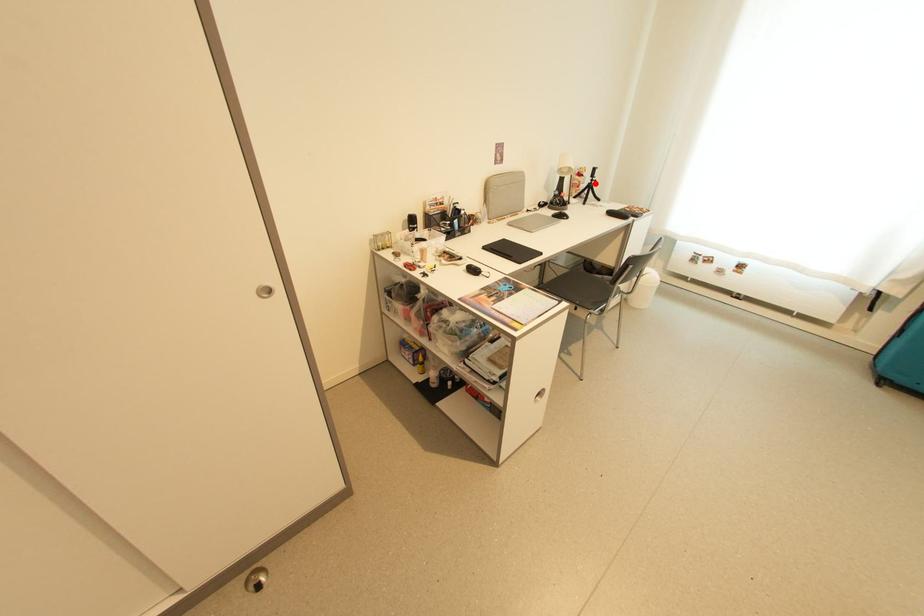
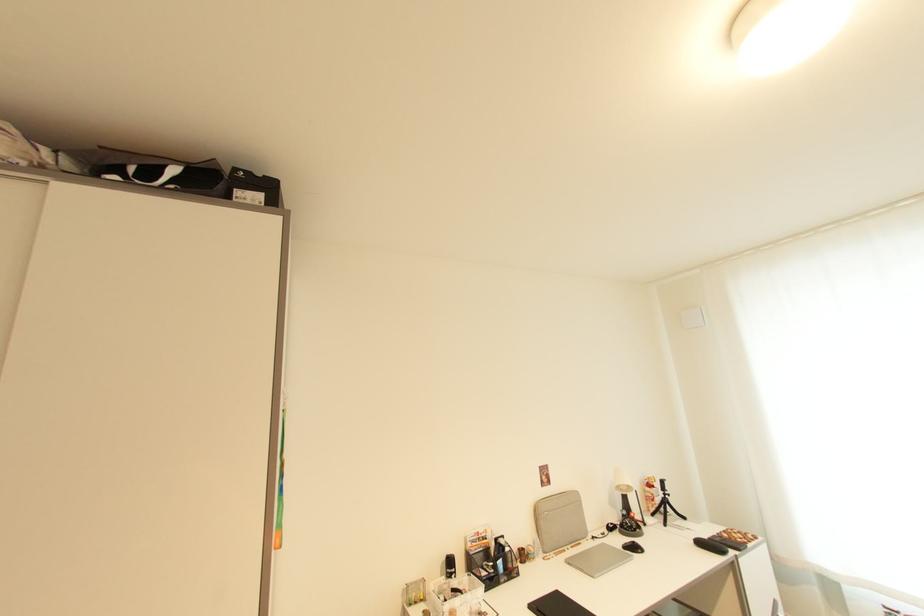
Where in the second image is the point corresponding to the highlighted location from the first image?

(669, 498)